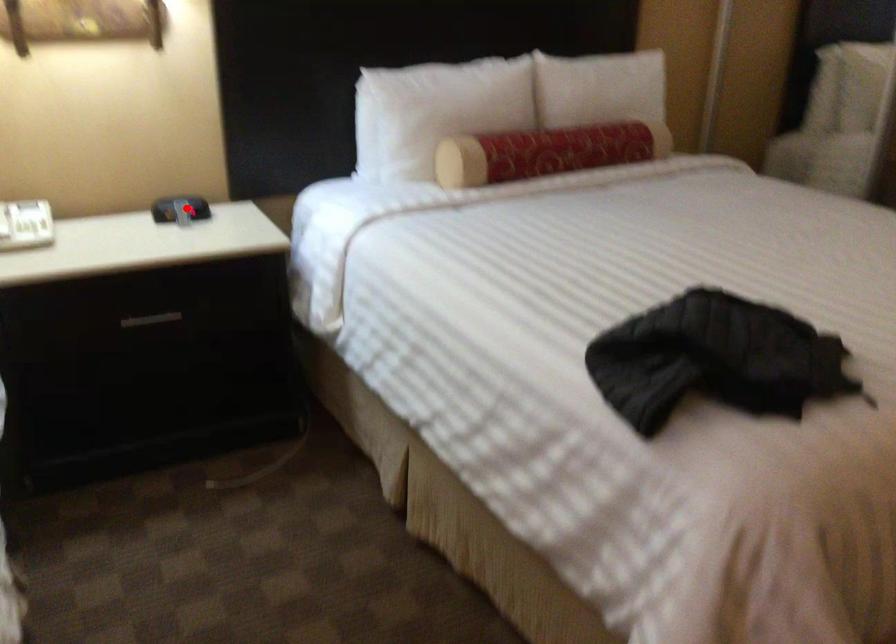
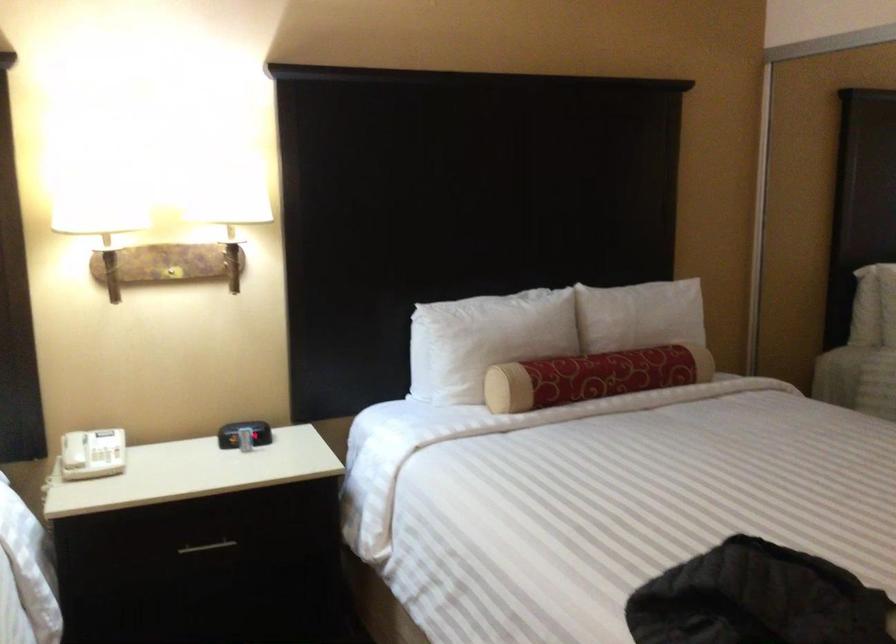
In the second image, find the point that corresponds to the highlighted location in the first image.

(244, 433)